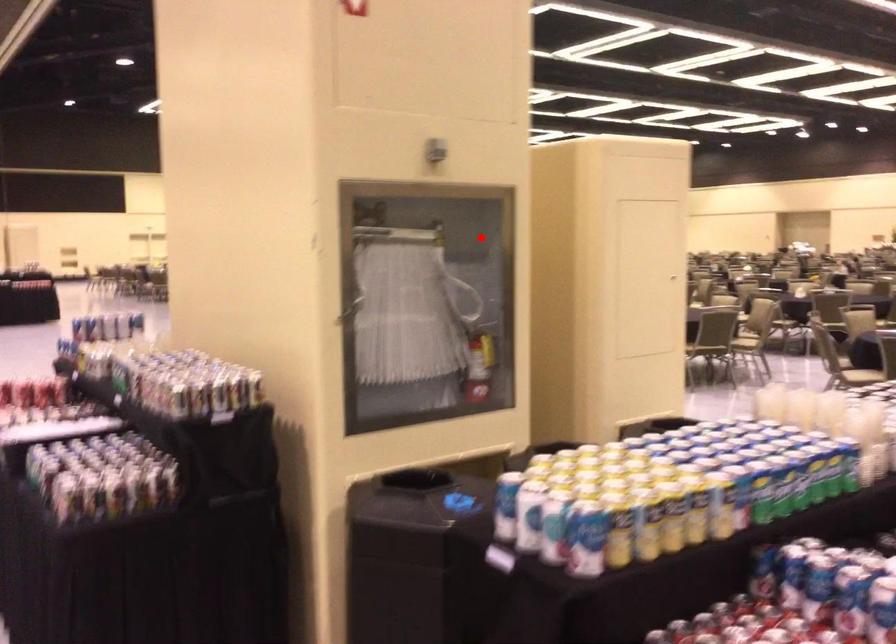
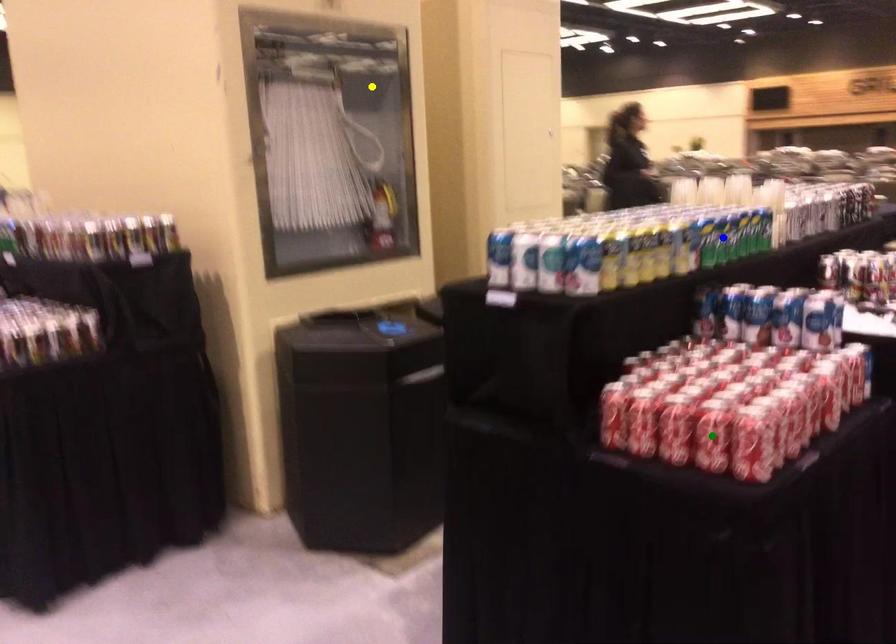
Question: I am providing you with two images of the same scene from different viewpoints. A red point is marked on the first image. You are given multiple points on the second image. Can you choose the point in image 2 that corresponds to the point in image 1?

Choices:
 (A) green point
 (B) blue point
 (C) yellow point

Answer: (C)